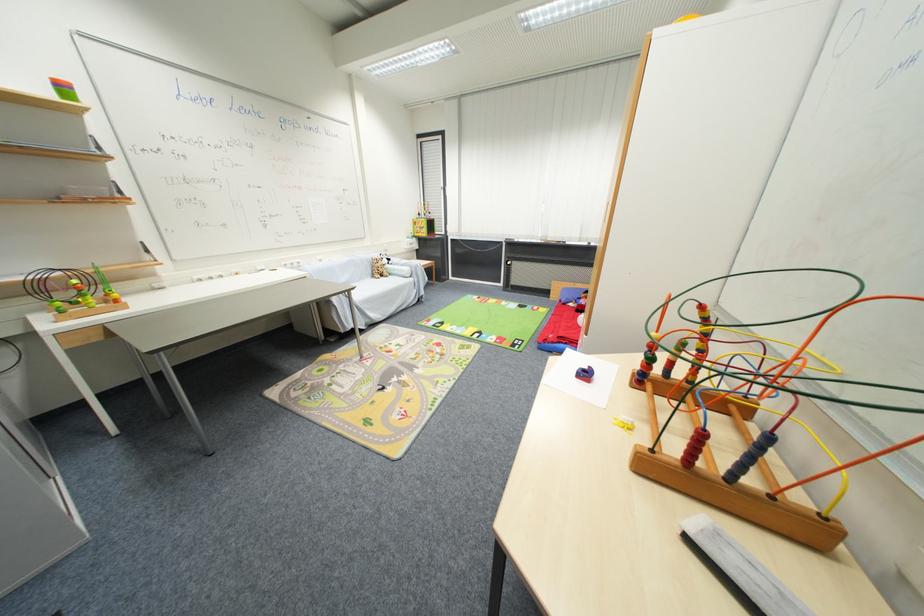
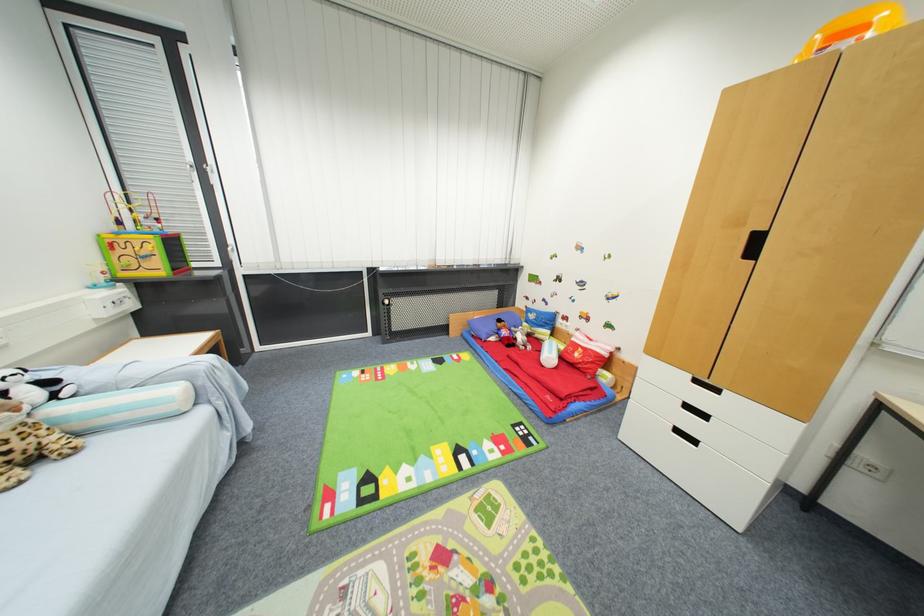
Find the pixel in the second image that matches point 489,338 in the first image.

(479, 455)